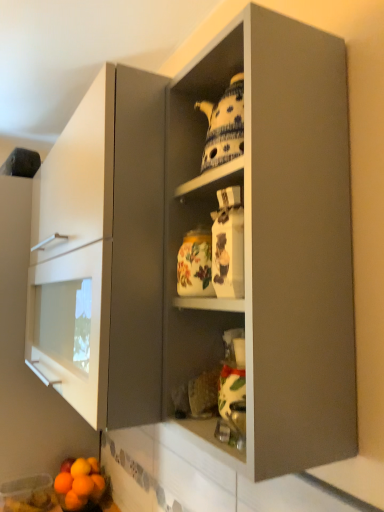
What is the approximate width of orange matte at lower left, which is the 4th orange in left-to-right order?

2.79 inches.

The image size is (384, 512). I want to click on orange matte at lower left, which is the second orange in right-to-left order, so click(x=83, y=486).

Identify the location of floral ceramic jar at center. The width and height of the screenshot is (384, 512). coord(195,264).

What is the approximate height of orange matte at lower left, which ranks as the fifth orange in right-to-left order?

orange matte at lower left, which ranks as the fifth orange in right-to-left order, is 2.84 inches in height.

Measure the distance between point (61, 489) and camera.

Point (61, 489) is 1.60 meters away from camera.

Identify the location of smooth orange grapefruit at lower left. The width and height of the screenshot is (384, 512). (79, 483).

The height and width of the screenshot is (512, 384). I want to click on orange matte at lower left, which is the 4th orange in left-to-right order, so click(x=83, y=486).

What's the angular difference between orange matte at lower left, which is the second orange in right-to-left order, and matte gray cabinet at center's facing directions?

orange matte at lower left, which is the second orange in right-to-left order, and matte gray cabinet at center are facing 2.93 degrees away from each other.

Is orange matte at lower left, which is the second orange in right-to-left order, looking in the opposite direction of matte gray cabinet at center?

No, matte gray cabinet at center is not at the back of orange matte at lower left, which is the second orange in right-to-left order.

From the image's perspective, does orange matte at lower left, which is the 4th orange in left-to-right order, appear lower than matte gray cabinet at center?

Correct, orange matte at lower left, which is the 4th orange in left-to-right order, appears lower than matte gray cabinet at center in the image.

Is orange matte at lower left, which is the 4th orange in left-to-right order, not close to matte gray cabinet at center?

Yes, orange matte at lower left, which is the 4th orange in left-to-right order, and matte gray cabinet at center are quite far apart.

Is orange matte at lower left, the 1th orange viewed from the left, inside the boundaries of orange matte at lower left, the fifth orange from the left, or outside?

The correct answer is: outside.

Image resolution: width=384 pixels, height=512 pixels. Identify the location of the 4th orange to the right of the orange matte at lower left, which ranks as the fifth orange in right-to-left order, starting your count from the anchor. click(x=98, y=485).

From the image's perspective, is orange matte at lower left, the 1th orange viewed from the left, above orange matte at lower left, arranged as the first orange when viewed from the right?

Indeed, from the image's perspective, orange matte at lower left, the 1th orange viewed from the left, is shown above orange matte at lower left, arranged as the first orange when viewed from the right.

Is orange matte at lower left, the 1th orange viewed from the left, next to orange matte at lower left, the fifth orange from the left?

No, orange matte at lower left, the 1th orange viewed from the left, is not with orange matte at lower left, the fifth orange from the left.

The height and width of the screenshot is (512, 384). In order to click on the 2nd orange to the left of the orange matte at lower left, which is the 4th orange in left-to-right order, counting from the anchor's position in this screenshot , I will do `click(74, 501)`.

From a real-world perspective, is orange matte at lower left, the 2th orange viewed from the left, under orange matte at lower left, which is the 4th orange in left-to-right order?

Yes.

Measure the distance between orange matte at lower left, the 2th orange viewed from the left, and orange matte at lower left, which is the 4th orange in left-to-right order.

The distance of orange matte at lower left, the 2th orange viewed from the left, from orange matte at lower left, which is the 4th orange in left-to-right order, is 1.43 inches.

Based on the photo, considering the sizes of orange matte at lower left, the 4th orange when ordered from right to left, and orange matte at lower left, which is the 4th orange in left-to-right order, in the image, is orange matte at lower left, the 4th orange when ordered from right to left, wider or thinner than orange matte at lower left, which is the 4th orange in left-to-right order,?

Considering their sizes, orange matte at lower left, the 4th orange when ordered from right to left, looks slimmer than orange matte at lower left, which is the 4th orange in left-to-right order.

Which of these two, matte gray cabinet at center or smooth orange grapefruit at lower left, is thinner?

smooth orange grapefruit at lower left is thinner.

From a real-world perspective, who is located lower, matte gray cabinet at center or smooth orange grapefruit at lower left?

smooth orange grapefruit at lower left.

Between point (132, 130) and point (64, 497), which one is positioned in front?

Positioned in front is point (132, 130).

Which object is thinner, orange matte at lower left, positioned as the 3th orange in right-to-left order, or matte gray cabinet at center?

orange matte at lower left, positioned as the 3th orange in right-to-left order, is thinner.

Would you consider orange matte at lower left, positioned as the 3th orange in right-to-left order, to be distant from matte gray cabinet at center?

Yes, orange matte at lower left, positioned as the 3th orange in right-to-left order, and matte gray cabinet at center are quite far apart.

Which point is more forward, (74, 466) or (101, 319)?

The point (101, 319) is in front.

Considering the sizes of orange matte at lower left, positioned as the 3th orange in right-to-left order, and matte gray cabinet at center in the image, is orange matte at lower left, positioned as the 3th orange in right-to-left order, taller or shorter than matte gray cabinet at center?

In the image, orange matte at lower left, positioned as the 3th orange in right-to-left order, appears to be shorter than matte gray cabinet at center.

Considering the positions of points (173, 122) and (82, 483), is point (173, 122) farther from camera compared to point (82, 483)?

No, it is in front of (82, 483).

Considering the sizes of objects porcelain teapot at upper center and orange matte at lower left, which is the second orange in right-to-left order, in the image provided, who is taller, porcelain teapot at upper center or orange matte at lower left, which is the second orange in right-to-left order,?

With more height is porcelain teapot at upper center.

How different are the orientations of porcelain teapot at upper center and orange matte at lower left, which is the second orange in right-to-left order, in degrees?

There is a 0.598-degree angle between the facing directions of porcelain teapot at upper center and orange matte at lower left, which is the second orange in right-to-left order.

From the image's perspective, is porcelain teapot at upper center on top of orange matte at lower left, which is the 4th orange in left-to-right order?

Yes, from the image's perspective, porcelain teapot at upper center is on top of orange matte at lower left, which is the 4th orange in left-to-right order.

Which is more to the right, floral ceramic jar at center or orange matte at lower left, placed as the third orange when sorted from left to right?

From the viewer's perspective, floral ceramic jar at center appears more on the right side.

Where is `pottery above the orange matte at lower left, positioned as the 3th orange in right-to-left order (from a real-world perspective)`? The width and height of the screenshot is (384, 512). pottery above the orange matte at lower left, positioned as the 3th orange in right-to-left order (from a real-world perspective) is located at coordinates (195, 264).

Considering the sizes of objects floral ceramic jar at center and orange matte at lower left, placed as the third orange when sorted from left to right, in the image provided, who is smaller, floral ceramic jar at center or orange matte at lower left, placed as the third orange when sorted from left to right,?

With smaller size is orange matte at lower left, placed as the third orange when sorted from left to right.

Which of these two, floral ceramic jar at center or orange matte at lower left, positioned as the 3th orange in right-to-left order, stands taller?

floral ceramic jar at center.

The width and height of the screenshot is (384, 512). What are the coordinates of `cabinetry that is on the right side of orange matte at lower left, which is the second orange in right-to-left order` in the screenshot? It's located at [x=107, y=246].

What are the coordinates of `the 1st orange in front of the orange matte at lower left, the fifth orange from the left` in the screenshot? It's located at (63, 483).

When comparing their distances from orange matte at lower left, placed as the third orange when sorted from left to right, does orange matte at lower left, the 2th orange viewed from the left, or floral ceramic jar at center seem further?

Based on the image, floral ceramic jar at center appears to be further to orange matte at lower left, placed as the third orange when sorted from left to right.

Based on their spatial positions, is porcelain teapot at upper center or smooth orange grapefruit at lower left further from orange matte at lower left, the fifth orange from the left?

Based on the image, porcelain teapot at upper center appears to be further to orange matte at lower left, the fifth orange from the left.

Which object lies nearer to the anchor point orange matte at lower left, the fifth orange from the left, orange matte at lower left, which is the second orange in right-to-left order, or matte gray cabinet at center?

orange matte at lower left, which is the second orange in right-to-left order.

Looking at the image, which one is located further to smooth orange grapefruit at lower left, floral ceramic jar at center or orange matte at lower left, the 2th orange viewed from the left?

floral ceramic jar at center.

Which object lies nearer to the anchor point orange matte at lower left, arranged as the first orange when viewed from the right, floral ceramic jar at center or smooth orange grapefruit at lower left?

smooth orange grapefruit at lower left is positioned closer to the anchor orange matte at lower left, arranged as the first orange when viewed from the right.

When comparing their distances from orange matte at lower left, which is the 4th orange in left-to-right order, does orange matte at lower left, the fifth orange from the left, or orange matte at lower left, positioned as the 3th orange in right-to-left order, seem further?

The object further to orange matte at lower left, which is the 4th orange in left-to-right order, is orange matte at lower left, positioned as the 3th orange in right-to-left order.

When comparing their distances from orange matte at lower left, positioned as the 3th orange in right-to-left order, does orange matte at lower left, which is the 4th orange in left-to-right order, or smooth orange grapefruit at lower left seem further?

Among the two, smooth orange grapefruit at lower left is located further to orange matte at lower left, positioned as the 3th orange in right-to-left order.

From the image, which object appears to be nearer to orange matte at lower left, which ranks as the fifth orange in right-to-left order, porcelain teapot at upper center or orange matte at lower left, the 2th orange viewed from the left?

orange matte at lower left, the 2th orange viewed from the left.

Find the location of `grapefruit situated between orange matte at lower left, which ranks as the fifth orange in right-to-left order, and orange matte at lower left, which is the 4th orange in left-to-right order, from left to right`. grapefruit situated between orange matte at lower left, which ranks as the fifth orange in right-to-left order, and orange matte at lower left, which is the 4th orange in left-to-right order, from left to right is located at coordinates (79, 483).

Identify the location of cabinetry between floral ceramic jar at center and orange matte at lower left, which is the 4th orange in left-to-right order, from top to bottom. (107, 246).

Locate an element on the screen. Image resolution: width=384 pixels, height=512 pixels. pottery that lies between porcelain teapot at upper center and orange matte at lower left, the 1th orange viewed from the left, from top to bottom is located at coordinates (195, 264).

The width and height of the screenshot is (384, 512). Find the location of `cabinetry between porcelain teapot at upper center and orange matte at lower left, which ranks as the fifth orange in right-to-left order, in the up-down direction`. cabinetry between porcelain teapot at upper center and orange matte at lower left, which ranks as the fifth orange in right-to-left order, in the up-down direction is located at coordinates (107, 246).